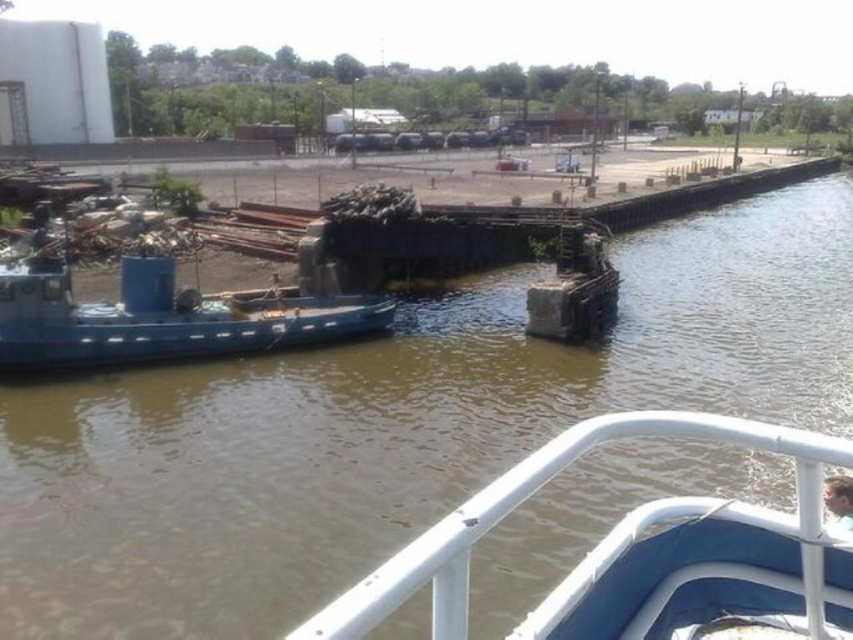
Question: Observing the image, what is the correct spatial positioning of white matte rail at lower center in reference to blue matte boat at left?

Choices:
 (A) left
 (B) right

Answer: (B)

Question: Which of these objects is positioned farthest from the white matte rail at lower center?

Choices:
 (A) smooth skin face at lower right
 (B) blue matte boat at left

Answer: (B)

Question: Which point appears farthest from the camera in this image?

Choices:
 (A) (340, 330)
 (B) (833, 522)

Answer: (A)

Question: Can you confirm if white matte rail at lower center is thinner than blue matte boat at left?

Choices:
 (A) yes
 (B) no

Answer: (B)

Question: Can you confirm if blue matte boat at left is thinner than smooth skin face at lower right?

Choices:
 (A) no
 (B) yes

Answer: (B)

Question: Which point is closer to the camera?

Choices:
 (A) (822, 490)
 (B) (283, 342)

Answer: (A)